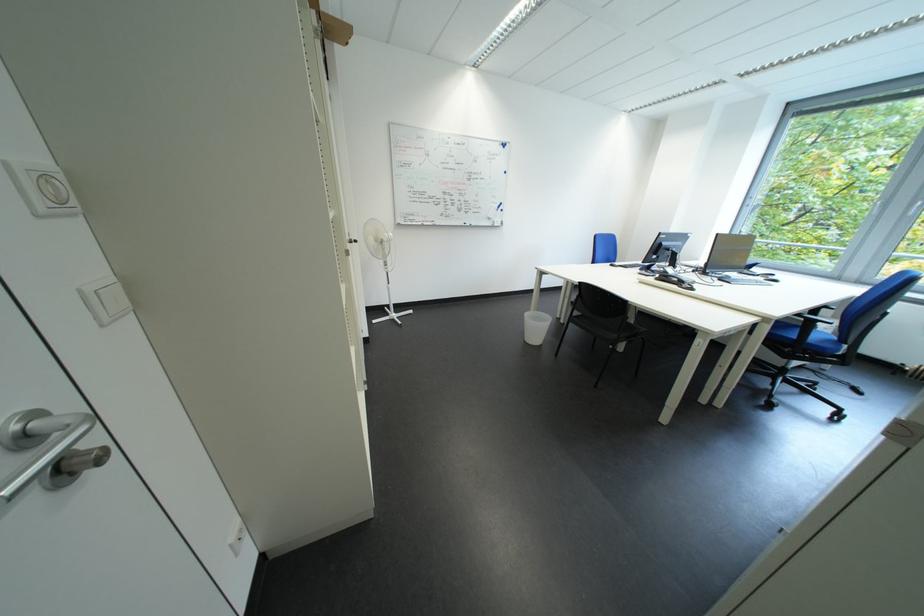
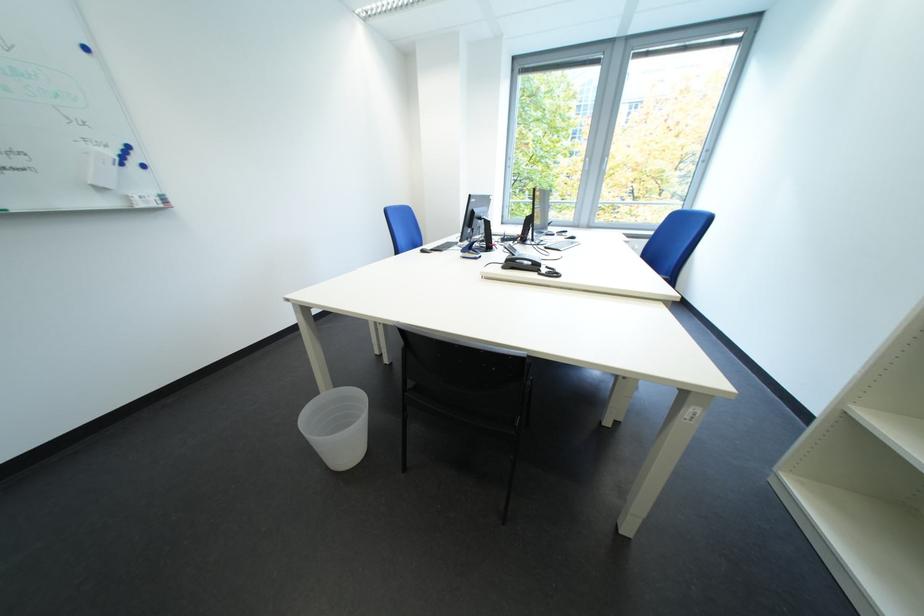
Find the pixel in the second image that matches point 768,272 in the first image.

(563, 232)